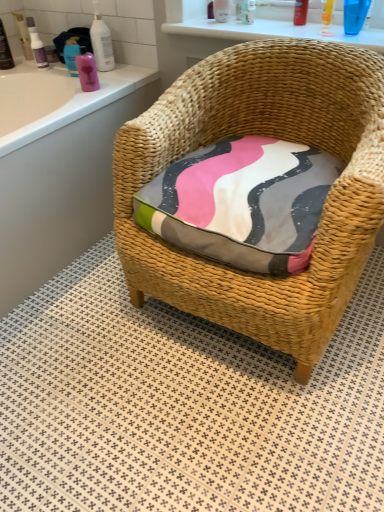
Locate an element on the screen. free space to the right of matte black bottle at upper left, which is the tenth toiletry from right to left is located at coordinates (27, 71).